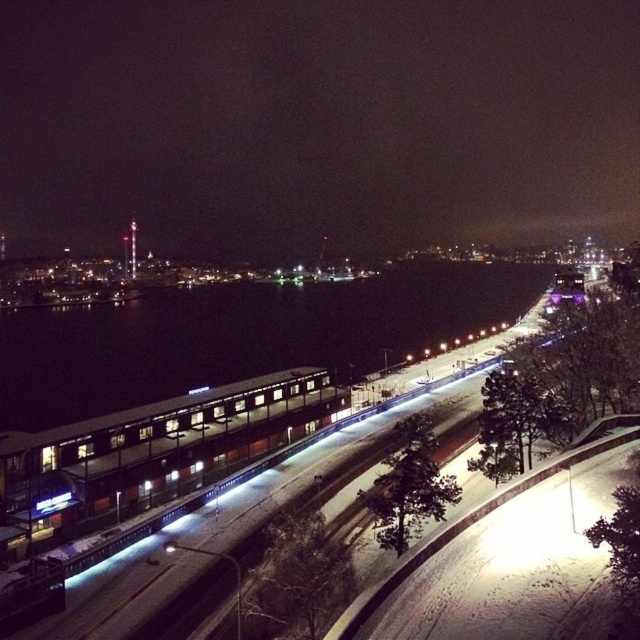
Question: Does dark glassy water at center lie behind matte glass passenger train at center?

Choices:
 (A) yes
 (B) no

Answer: (A)

Question: Based on their relative distances, which object is nearer to the black water at center?

Choices:
 (A) dark glassy water at center
 (B) matte glass passenger train at center

Answer: (B)

Question: Does dark glassy water at center appear under matte glass passenger train at center?

Choices:
 (A) yes
 (B) no

Answer: (B)

Question: Can you confirm if black water at center is wider than matte glass passenger train at center?

Choices:
 (A) yes
 (B) no

Answer: (A)

Question: Among these objects, which one is nearest to the camera?

Choices:
 (A) dark glassy water at center
 (B) black water at center

Answer: (B)

Question: Among these objects, which one is farthest from the camera?

Choices:
 (A) matte glass passenger train at center
 (B) black water at center

Answer: (B)